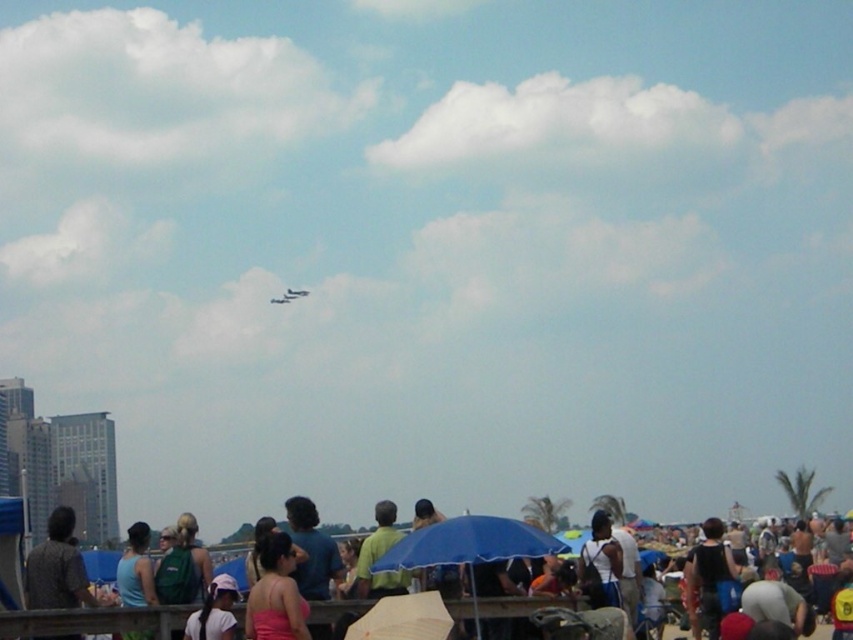
Which is in front, point (473, 563) or point (297, 296)?

Point (473, 563) is in front.

Can you confirm if blue matte umbrella at center is bigger than shiny silver airplane at upper center?

No.

Which is behind, point (511, 524) or point (303, 292)?

Positioned behind is point (303, 292).

Where is `blue matte umbrella at center`? This screenshot has width=853, height=640. blue matte umbrella at center is located at coordinates (467, 544).

Is dark gray shirt at lower left taller than pink fabric cap at lower center?

Yes, dark gray shirt at lower left is taller than pink fabric cap at lower center.

The image size is (853, 640). What do you see at coordinates (56, 566) in the screenshot?
I see `dark gray shirt at lower left` at bounding box center [56, 566].

Locate an element on the screen. dark gray shirt at lower left is located at coordinates (56, 566).

Does blue matte umbrella at center appear over pink matte tank top at center?

Yes.

Can you confirm if blue matte umbrella at center is wider than pink matte tank top at center?

Yes, blue matte umbrella at center is wider than pink matte tank top at center.

Is point (381, 556) more distant than point (271, 625)?

Yes, point (381, 556) is farther from viewer.

Locate an element on the screen. blue matte umbrella at center is located at coordinates (467, 544).